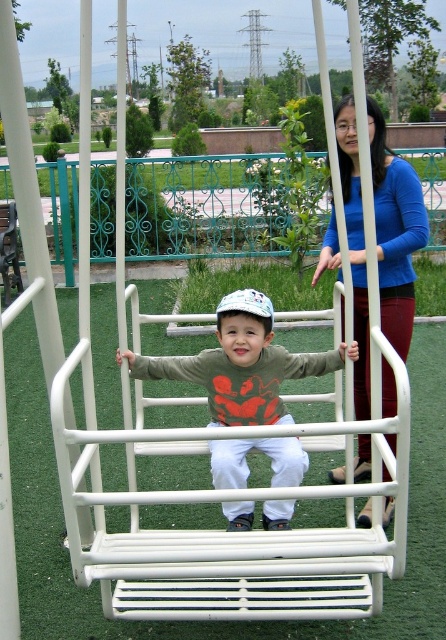
Is blue fabric shirt at upper center above matte green sweatshirt at center?

Indeed, blue fabric shirt at upper center is positioned over matte green sweatshirt at center.

Between point (341, 314) and point (293, 467), which one is positioned in front?

Point (293, 467) is in front.

The image size is (446, 640). I want to click on blue fabric shirt at upper center, so click(395, 230).